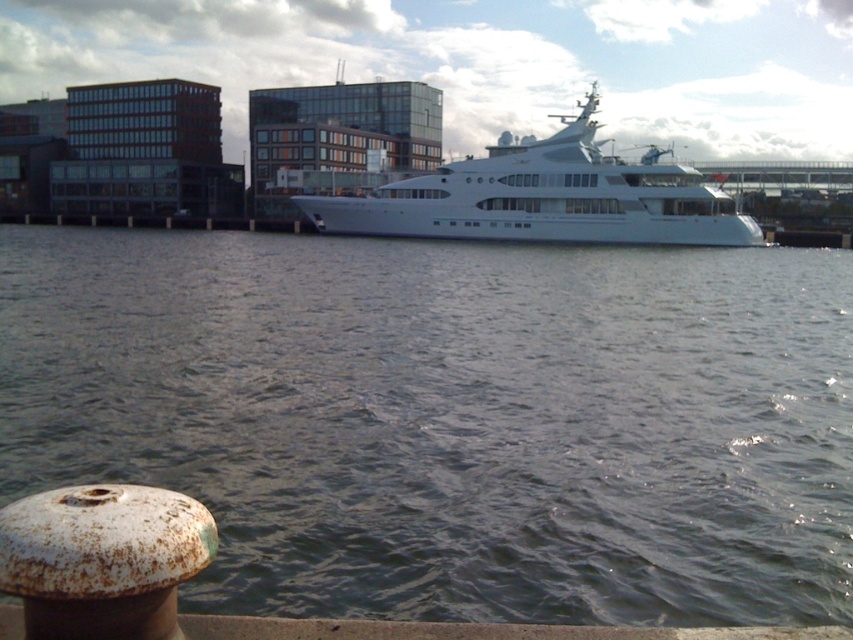
Who is shorter, clear water at center or white glossy cruise ship at center?

Standing shorter between the two is clear water at center.

Does point (618, 328) come farther from viewer compared to point (337, 202)?

No, it is in front of (337, 202).

Is point (701, 490) positioned before point (735, 220)?

That is True.

Locate an element on the screen. clear water at center is located at coordinates (450, 419).